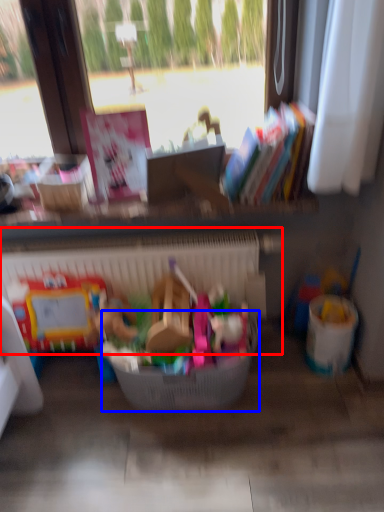
Question: Which object appears closest to the camera in this image, radiator (highlighted by a red box) or basket (highlighted by a blue box)?

Choices:
 (A) radiator
 (B) basket

Answer: (B)